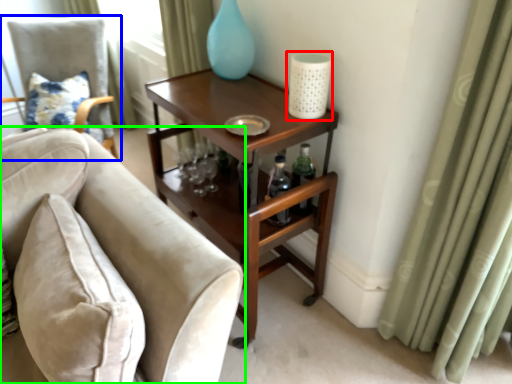
Question: Based on their relative distances, which object is nearer to candle holder (highlighted by a red box)? Choose from chair (highlighted by a blue box) and chair (highlighted by a green box).

Choices:
 (A) chair
 (B) chair

Answer: (B)